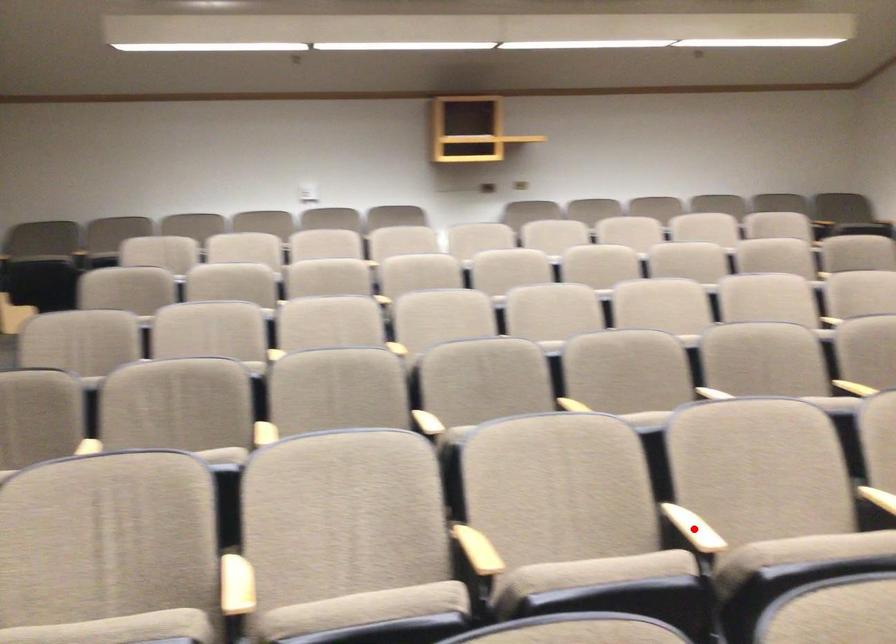
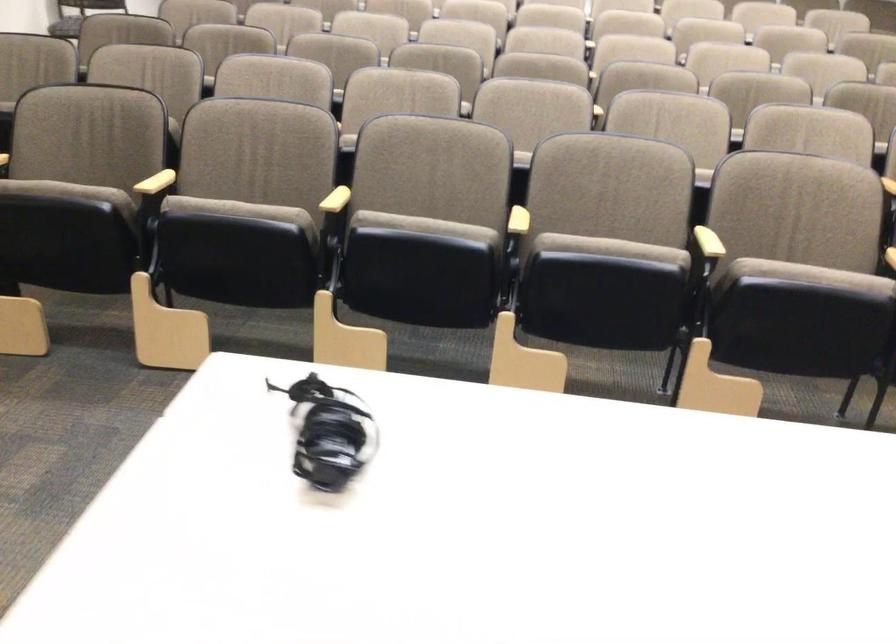
Question: I am providing you with two images of the same scene from different viewpoints. A red point is marked on the first image. Is the red point's position out of view in image 2?

Choices:
 (A) Yes
 (B) No

Answer: (A)